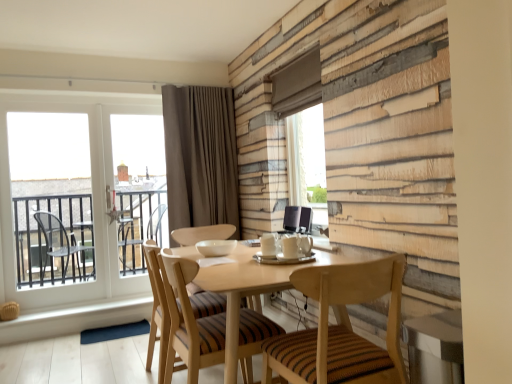
At what (x,y) coordinates should I click in order to perform the action: click on vacant space in transparent glass door at left, which is the second window screen from front to back (from a real-world perspective). Please return your answer as a coordinate pair (x, y). Image resolution: width=512 pixels, height=384 pixels. Looking at the image, I should click on (59, 307).